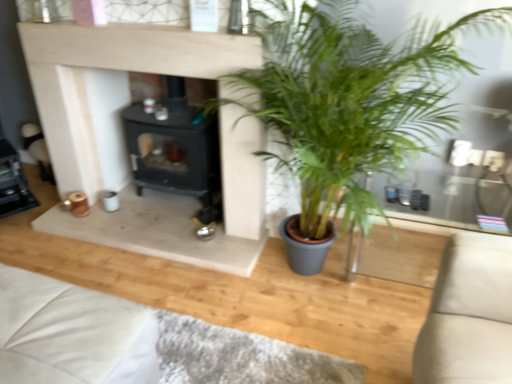
Describe the element at coordinates (72, 334) in the screenshot. I see `white leather couch at lower left` at that location.

Where is `black matte fireplace at center`? This screenshot has width=512, height=384. black matte fireplace at center is located at coordinates (173, 152).

How different are the orientations of black matte fireplace at center and green leafy plant at center in degrees?

black matte fireplace at center and green leafy plant at center are facing 0.042 degrees away from each other.

Does black matte fireplace at center have a lesser height compared to green leafy plant at center?

Correct, black matte fireplace at center is not as tall as green leafy plant at center.

Is black matte fireplace at center aimed at green leafy plant at center?

No, black matte fireplace at center is not oriented towards green leafy plant at center.

Does white leather couch at lower left turn towards black matte fireplace at center?

No.

Image resolution: width=512 pixels, height=384 pixels. In the image, there is a black matte fireplace at center. What are the coordinates of `couch below it (from the image's perspective)` in the screenshot? It's located at (72, 334).

Which of these two, white leather couch at lower left or black matte fireplace at center, is wider?

white leather couch at lower left is wider.

Which of these two, green leafy plant at center or white leather couch at lower left, is smaller?

white leather couch at lower left is smaller.

From a real-world perspective, is green leafy plant at center positioned above or below white leather couch at lower left?

Clearly, from a real-world perspective, green leafy plant at center is above white leather couch at lower left.

Where is `houseplant above the white leather couch at lower left (from the image's perspective)`? houseplant above the white leather couch at lower left (from the image's perspective) is located at coordinates (348, 101).

From the picture: From the image's perspective, who appears lower, green leafy plant at center or white leather couch at lower left?

white leather couch at lower left, from the image's perspective.

Between black matte fireplace at center and white leather couch at lower left, which one has more height?

With more height is black matte fireplace at center.

The width and height of the screenshot is (512, 384). I want to click on fireplace behind the white leather couch at lower left, so click(x=173, y=152).

Considering the relative sizes of black matte fireplace at center and white leather couch at lower left in the image provided, is black matte fireplace at center smaller than white leather couch at lower left?

No, black matte fireplace at center is not smaller than white leather couch at lower left.

From the image's perspective, is black matte fireplace at center over white leather couch at lower left?

Yes, from the image's perspective, black matte fireplace at center is on top of white leather couch at lower left.

Considering the sizes of white leather couch at lower left and green leafy plant at center in the image, is white leather couch at lower left bigger or smaller than green leafy plant at center?

white leather couch at lower left is smaller than green leafy plant at center.

Find the location of a particular element. couch below the green leafy plant at center (from the image's perspective) is located at coordinates (72, 334).

Considering the sizes of objects white leather couch at lower left and green leafy plant at center in the image provided, who is shorter, white leather couch at lower left or green leafy plant at center?

With less height is white leather couch at lower left.

Is the position of green leafy plant at center less distant than that of black matte fireplace at center?

Yes, green leafy plant at center is closer to the viewer.

From the image's perspective, would you say green leafy plant at center is shown under black matte fireplace at center?

Indeed, from the image's perspective, green leafy plant at center is shown beneath black matte fireplace at center.

Is there a large distance between green leafy plant at center and black matte fireplace at center?

That's not correct — green leafy plant at center is a little close to black matte fireplace at center.

Which object is positioned more to the right, green leafy plant at center or black matte fireplace at center?

green leafy plant at center.

You are a GUI agent. You are given a task and a screenshot of the screen. Output one action in this format:
    pyautogui.click(x=<x>, y=<y>)
    Task: Click on the fireplace beneath the green leafy plant at center (from a real-world perspective)
    This screenshot has width=512, height=384.
    Given the screenshot: What is the action you would take?
    pyautogui.click(x=173, y=152)

Locate an element on the screen. fireplace behind the white leather couch at lower left is located at coordinates (173, 152).

Based on their spatial positions, is black matte fireplace at center or green leafy plant at center further from white leather couch at lower left?

Among the two, black matte fireplace at center is located further to white leather couch at lower left.

Which object lies further to the anchor point white leather couch at lower left, green leafy plant at center or black matte fireplace at center?

→ black matte fireplace at center lies further to white leather couch at lower left than the other object.

From the image, which object appears to be nearer to black matte fireplace at center, white leather couch at lower left or green leafy plant at center?

green leafy plant at center is closer to black matte fireplace at center.

Looking at the image, which one is located closer to black matte fireplace at center, green leafy plant at center or white leather couch at lower left?

Based on the image, green leafy plant at center appears to be nearer to black matte fireplace at center.

When comparing their distances from green leafy plant at center, does black matte fireplace at center or white leather couch at lower left seem closer?

black matte fireplace at center is positioned closer to the anchor green leafy plant at center.

Which object lies nearer to the anchor point green leafy plant at center, white leather couch at lower left or black matte fireplace at center?

Among the two, black matte fireplace at center is located nearer to green leafy plant at center.

Locate an element on the screen. couch positioned between green leafy plant at center and black matte fireplace at center from near to far is located at coordinates (72, 334).